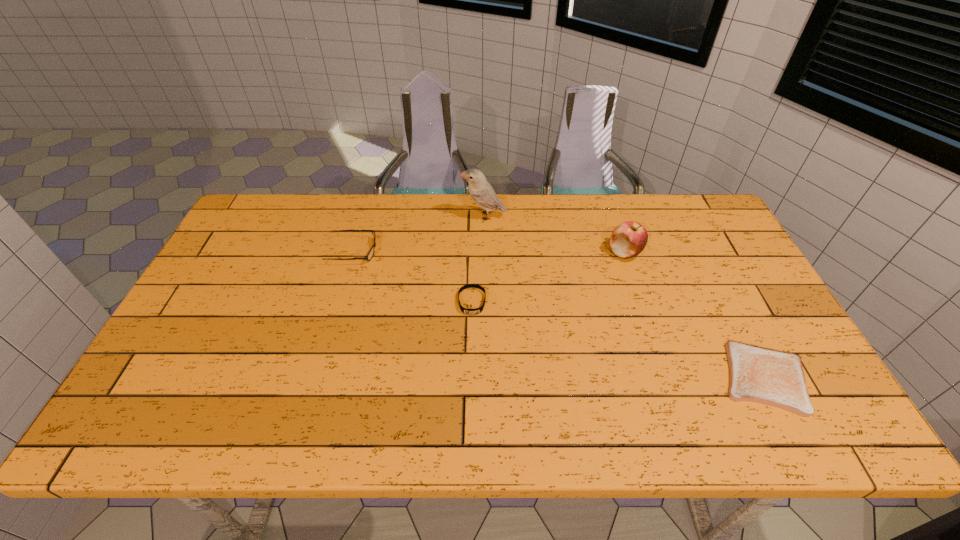
You are a GUI agent. You are given a task and a screenshot of the screen. Output one action in this format:
    pyautogui.click(x=<x>, y=<y>)
    Task: Click on the object that is at the right edge
    Image resolution: width=960 pixels, height=540 pixels.
    Given the screenshot: What is the action you would take?
    pyautogui.click(x=758, y=374)

You are a GUI agent. You are given a task and a screenshot of the screen. Output one action in this format:
    pyautogui.click(x=<x>, y=<y>)
    Task: Click on the object present at the near right corner
    Image resolution: width=960 pixels, height=540 pixels.
    Given the screenshot: What is the action you would take?
    pyautogui.click(x=758, y=374)

This screenshot has height=540, width=960. Identify the location of vacant space at the far edge of the desktop. (338, 214).

Where is `free space at the near edge`? free space at the near edge is located at coordinates (499, 437).

Locate an element on the screen. free space at the left edge of the desktop is located at coordinates (212, 352).

I want to click on free space at the right edge of the desktop, so click(726, 277).

The image size is (960, 540). Find the location of `vacant space at the far left corner of the desktop`. vacant space at the far left corner of the desktop is located at coordinates (282, 207).

Image resolution: width=960 pixels, height=540 pixels. Find the location of `free space at the far right corner of the desktop`. free space at the far right corner of the desktop is located at coordinates (689, 234).

The height and width of the screenshot is (540, 960). In order to click on free space between the fourth object from left to right and the wristband in this screenshot , I will do `click(548, 277)`.

Locate an element on the screen. Image resolution: width=960 pixels, height=540 pixels. free spot between the bird and the sunglasses is located at coordinates (419, 234).